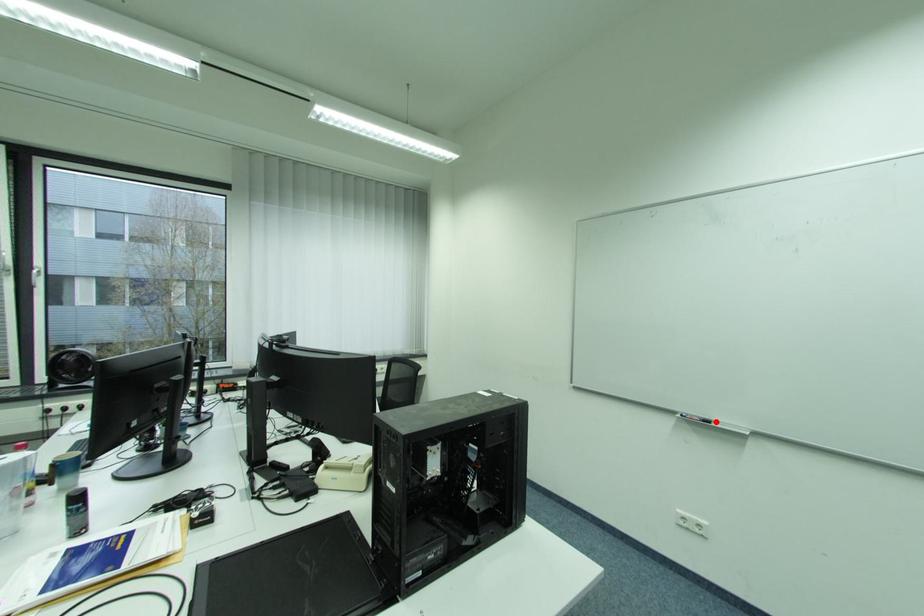
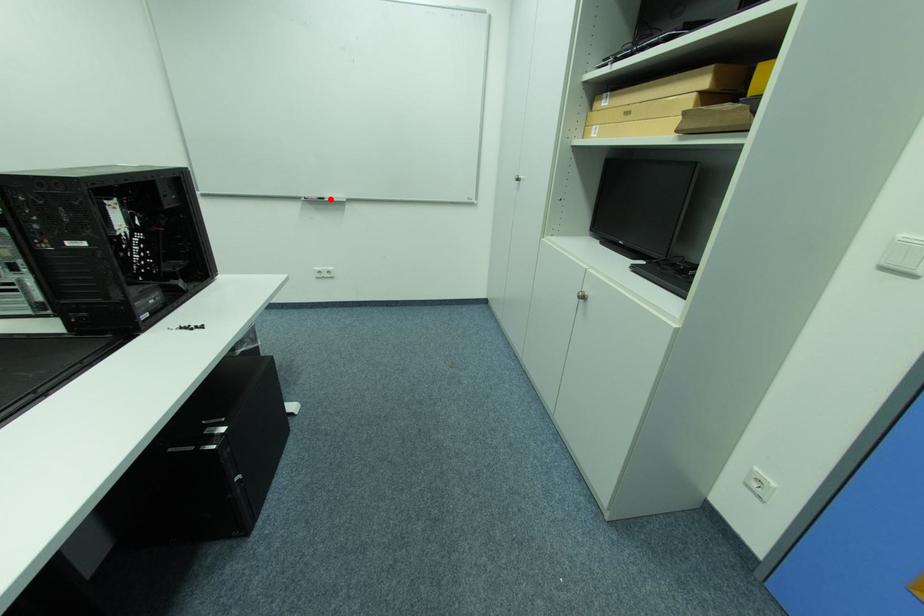
I am providing you with two images of the same scene from different viewpoints. A red point is marked on the first image and another point is marked on the second image. Is the red point in image1 aligned with the point shown in image2?

Yes